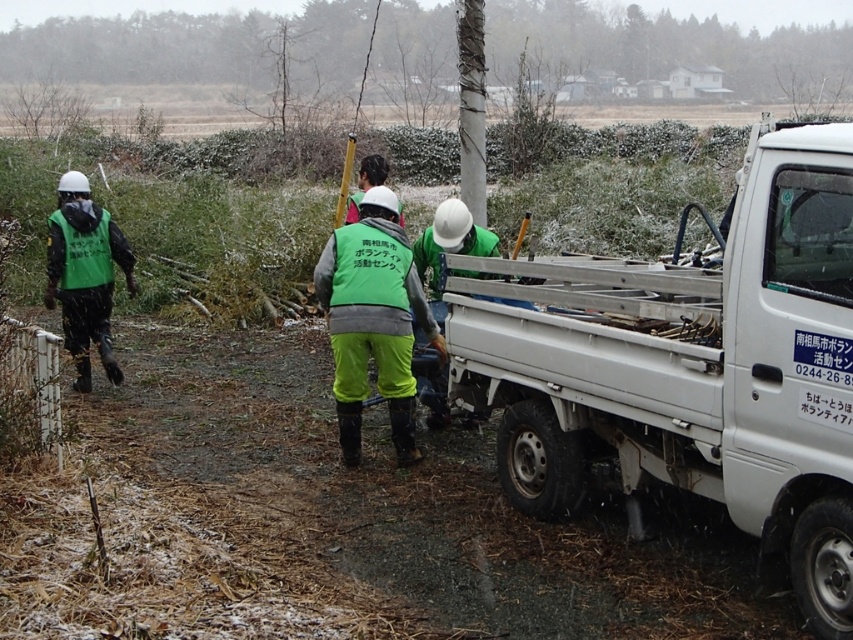
Question: Can you confirm if white metallic truck at right is positioned below green fabric safety vest at center?

Choices:
 (A) yes
 (B) no

Answer: (A)

Question: Does white metallic truck at right have a lesser width compared to green fabric safety vest at center?

Choices:
 (A) no
 (B) yes

Answer: (A)

Question: Which point is farther to the camera?

Choices:
 (A) white metallic truck at right
 (B) green matte vest at left
 (C) white bark tree at upper center

Answer: (C)

Question: Is white metallic truck at right above white bark tree at upper center?

Choices:
 (A) yes
 (B) no

Answer: (B)

Question: Which of the following is the farthest from the observer?

Choices:
 (A) green fabric safety vest at center
 (B) white bark tree at upper center

Answer: (B)

Question: Which of the following is the farthest from the observer?

Choices:
 (A) (312, 58)
 (B) (567, 259)
 (C) (93, 212)
 (D) (407, 300)

Answer: (A)